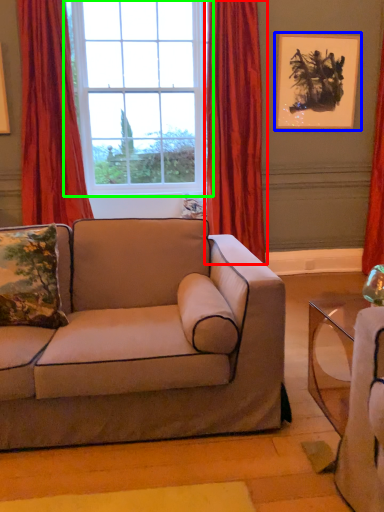
Question: Considering the real-world distances, which object is farthest from curtain (highlighted by a red box)? picture frame (highlighted by a blue box) or window (highlighted by a green box)?

Choices:
 (A) picture frame
 (B) window

Answer: (B)